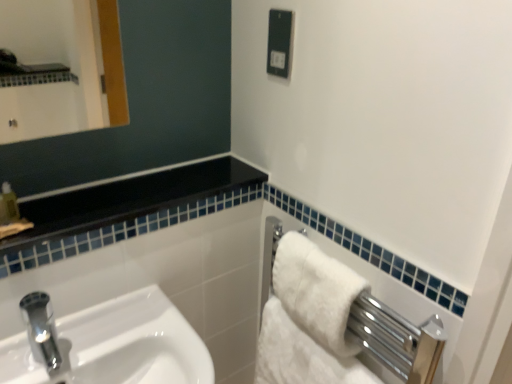
Question: From a real-world perspective, is black glossy balustrade at upper left above or below white fluffy bath towel at right, positioned as the 1th bath towel in bottom-to-top order?

Choices:
 (A) above
 (B) below

Answer: (A)

Question: Choose the correct answer: Is black glossy balustrade at upper left inside white fluffy bath towel at right, the second bath towel viewed from the top, or outside it?

Choices:
 (A) outside
 (B) inside

Answer: (A)

Question: Which object is positioned farthest from the white fluffy bath towel at right, the 1th bath towel viewed from the top?

Choices:
 (A) white glossy sink at lower left
 (B) black glossy balustrade at upper left
 (C) black plastic electric outlet at upper center
 (D) white fluffy bath towel at right, the second bath towel viewed from the top

Answer: (C)

Question: Considering the real-world distances, which object is closest to the black plastic electric outlet at upper center?

Choices:
 (A) white glossy sink at lower left
 (B) white fluffy bath towel at right, which is counted as the 2th bath towel, starting from the bottom
 (C) white fluffy bath towel at right, positioned as the 1th bath towel in bottom-to-top order
 (D) black glossy balustrade at upper left

Answer: (D)